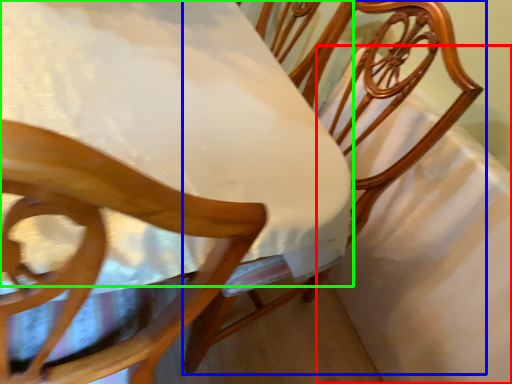
Question: Based on their relative distances, which object is nearer to sheet (highlighted by a red box)? Choose from chair (highlighted by a blue box) and table (highlighted by a green box).

Choices:
 (A) chair
 (B) table

Answer: (A)